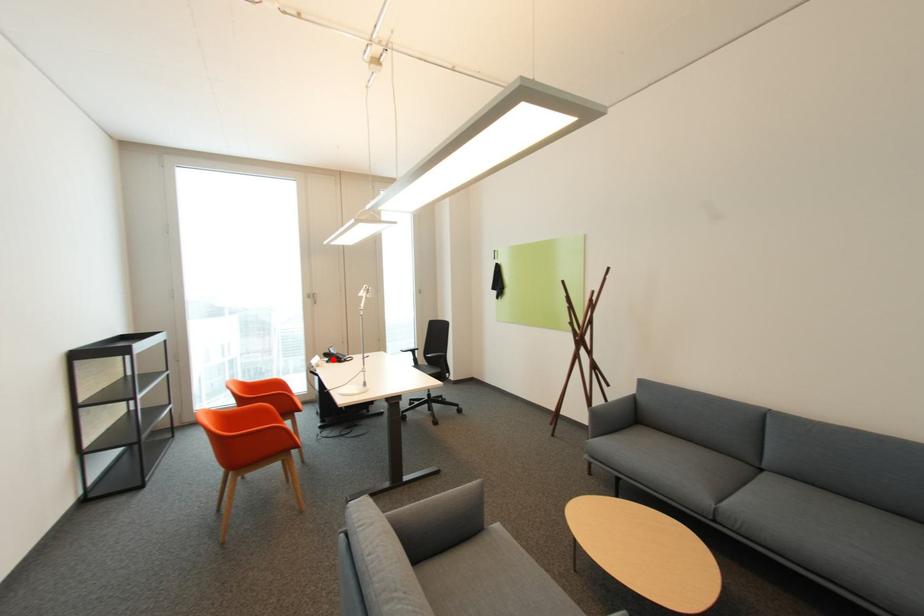
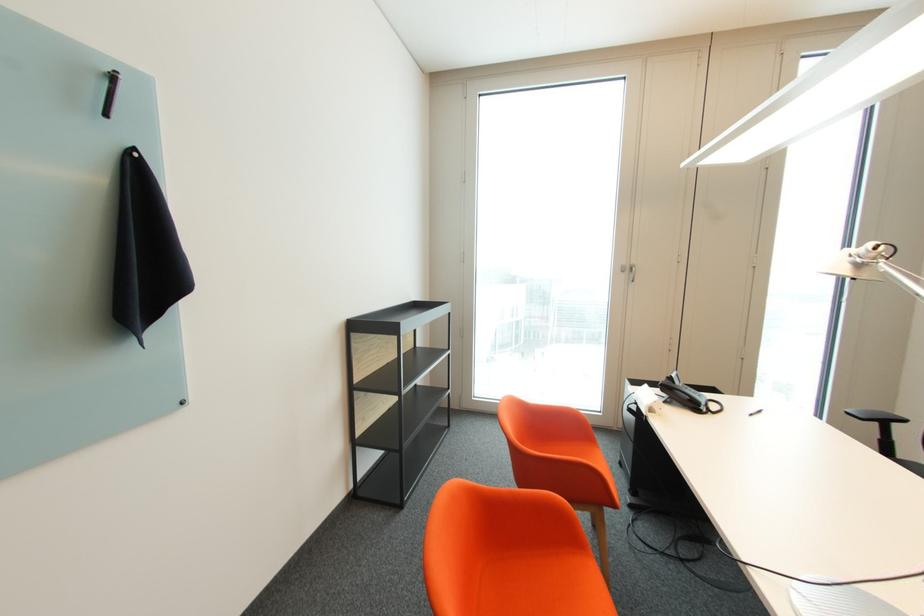
Question: I am providing you with two images of the same scene from different viewpoints. Image1 has a red point marked. In image2, the corresponding 3D location appears at what relative position? Reply with the corresponding letter.

Choices:
 (A) Closer
 (B) Farther

Answer: (A)